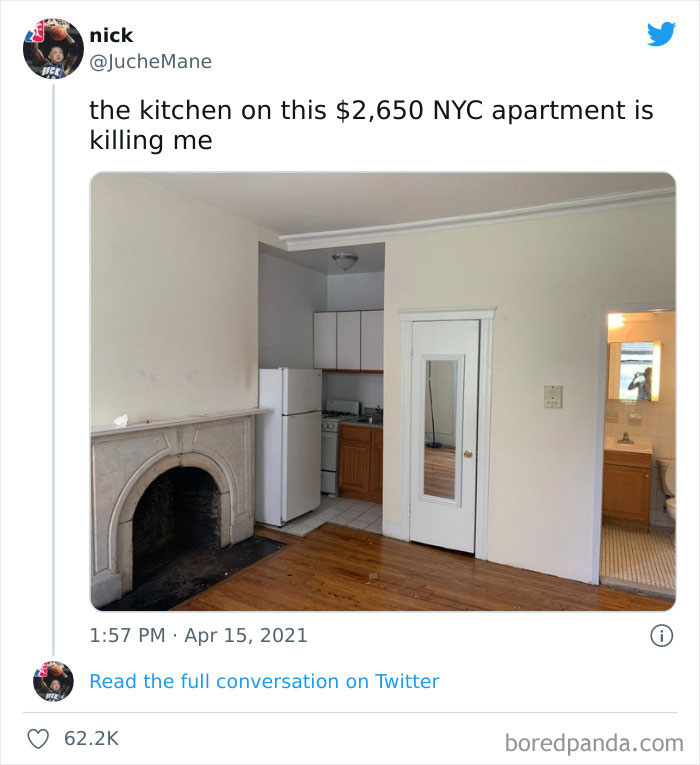
At what (x,y) coordinates should I click in order to perform the action: click on wall. Please return your answer as a coordinate pair (x, y). Image resolution: width=700 pixels, height=765 pixels. Looking at the image, I should click on (519, 314).